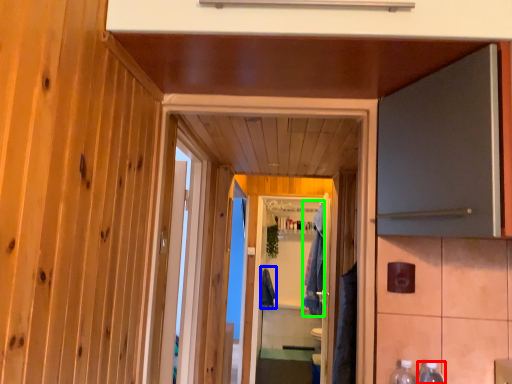
Question: Considering the real-world distances, which object is closest to bottle (highlighted by a red box)? robe (highlighted by a blue box) or robe (highlighted by a green box).

Choices:
 (A) robe
 (B) robe

Answer: (B)